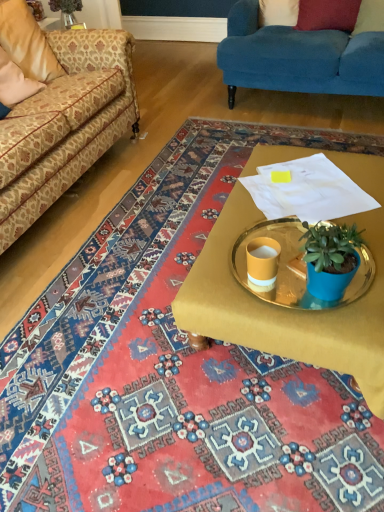
The height and width of the screenshot is (512, 384). In order to click on free space to the left of velvet blue couch at upper right, which appears as the 2th studio couch when viewed from the left in this screenshot , I will do `click(173, 97)`.